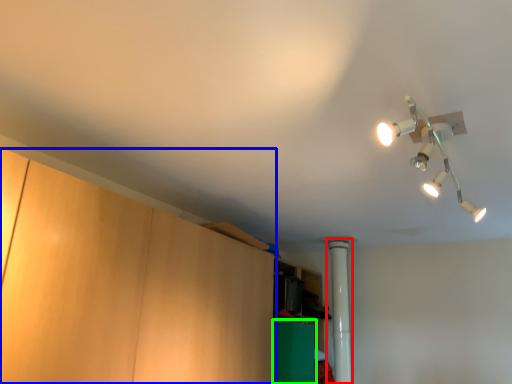
Question: Which is farther away from pipe (highlighted by a red box)? cabinetry (highlighted by a blue box) or cabinetry (highlighted by a green box)?

Choices:
 (A) cabinetry
 (B) cabinetry

Answer: (A)